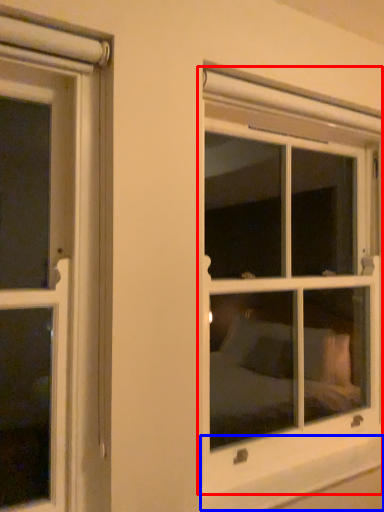
Question: Which of the following is the closest to the observer, window (highlighted by a red box) or window sill (highlighted by a blue box)?

Choices:
 (A) window
 (B) window sill

Answer: (B)